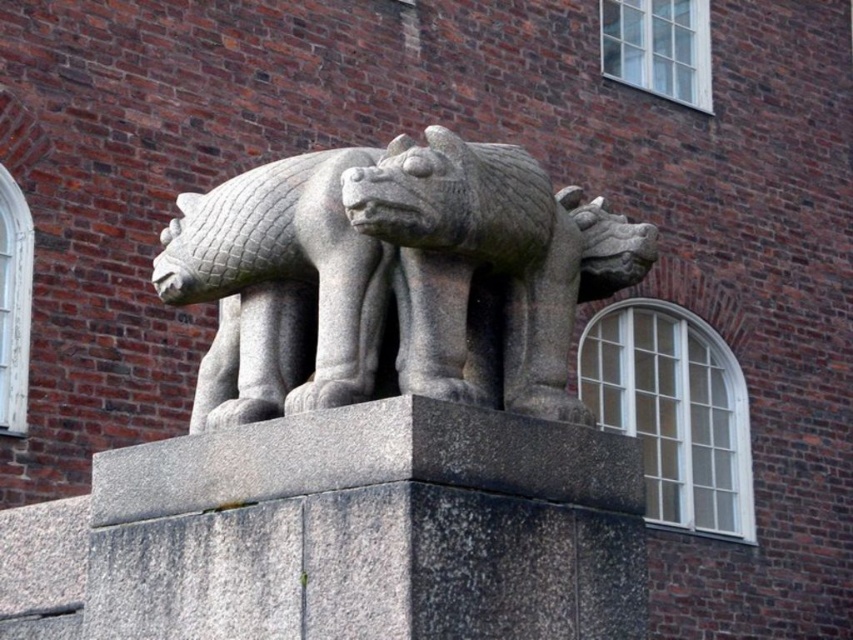
Which is behind, point (437, 358) or point (157, 275)?

Positioned behind is point (157, 275).

Does gray stone statue at center appear on the left side of gray stone lion at center?

Incorrect, gray stone statue at center is not on the left side of gray stone lion at center.

Where is `gray stone statue at center`? gray stone statue at center is located at coordinates (393, 278).

What are the coordinates of `gray stone statue at center` in the screenshot? It's located at (393, 278).